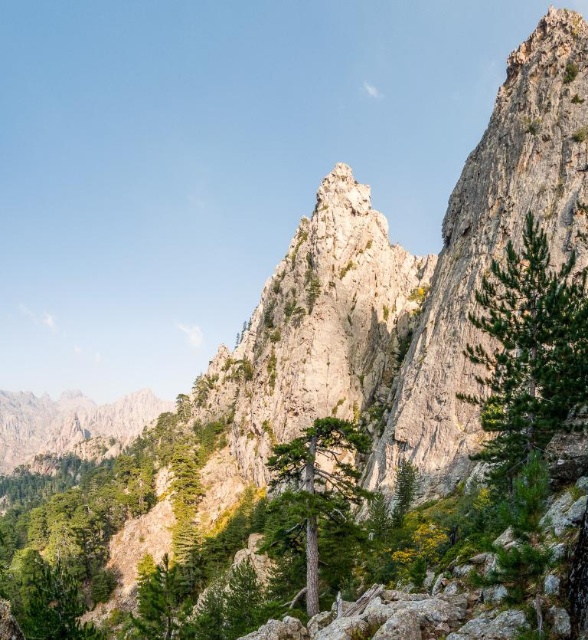
Question: Which of the following is the closest to the observer?

Choices:
 (A) green rough bark tree at right
 (B) green rough bark tree at center

Answer: (A)

Question: Does green rough bark tree at right have a greater width compared to green rough bark tree at center?

Choices:
 (A) no
 (B) yes

Answer: (B)

Question: Does green rough bark tree at right come in front of green rough bark tree at center?

Choices:
 (A) no
 (B) yes

Answer: (B)

Question: Is green rough bark tree at right smaller than green rough bark tree at center?

Choices:
 (A) yes
 (B) no

Answer: (A)

Question: Which point is closer to the camera?

Choices:
 (A) green rough bark tree at center
 (B) green rough bark tree at right

Answer: (B)